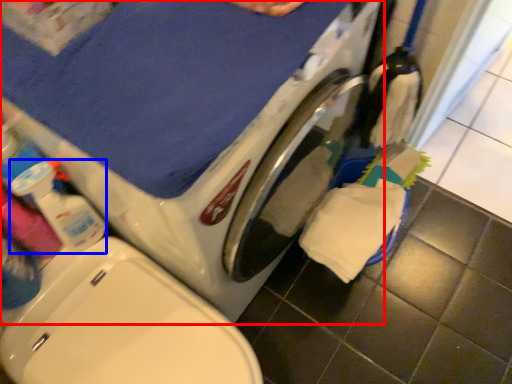
Question: Which of the following is the closest to the observer, washing machine (highlighted by a red box) or cleaning product (highlighted by a blue box)?

Choices:
 (A) washing machine
 (B) cleaning product

Answer: (A)